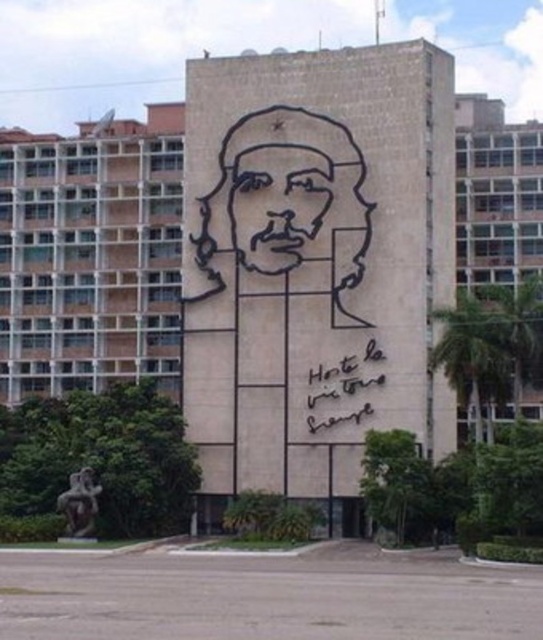
Question: Which object is positioned farthest from the black wire sculpture at center?

Choices:
 (A) black wireframe face at center
 (B) black calligraphy at lower right

Answer: (B)

Question: Estimate the real-world distances between objects in this image. Which object is closer to the black wire sculpture at center?

Choices:
 (A) black calligraphy at lower right
 (B) black wireframe face at center

Answer: (B)

Question: Which object appears closest to the camera in this image?

Choices:
 (A) black calligraphy at lower right
 (B) black wireframe face at center

Answer: (A)

Question: Is black wireframe face at center wider than black calligraphy at lower right?

Choices:
 (A) no
 (B) yes

Answer: (A)

Question: Can you confirm if black wire sculpture at center is smaller than black calligraphy at lower right?

Choices:
 (A) yes
 (B) no

Answer: (B)

Question: In this image, where is black wire sculpture at center located relative to black wireframe face at center?

Choices:
 (A) right
 (B) left

Answer: (B)